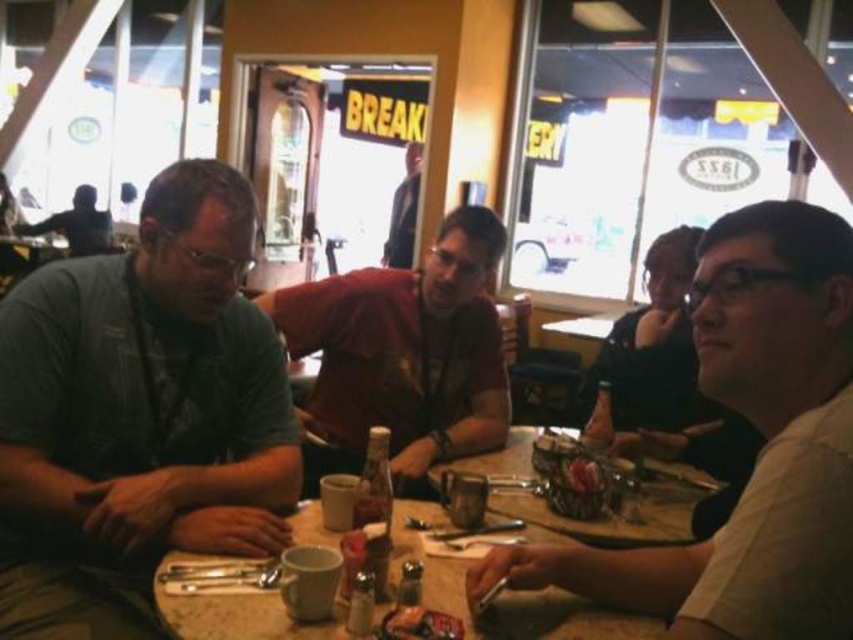
You are sitting at the round table in the dining scene and want to reach both the point at (x=393, y=243) and the point at (x=419, y=621). Which point is closer to you?

The point at (x=393, y=243) is closer to you because it is further to the viewer than the point at (x=419, y=621).

You are a waiter in the restaurant and you see two customers wearing a white matte shirt at center and a matte red shirt at center. Which customer is sitting closer to the floor?

The white matte shirt at center is located below the matte red shirt at center, so the customer wearing the white matte shirt at center is sitting closer to the floor.